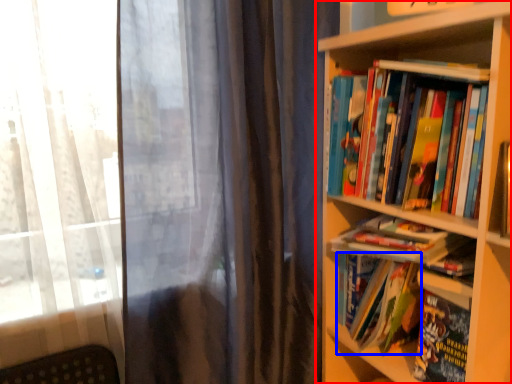
Question: Which of the following is the closest to the observer, bookcase (highlighted by a red box) or book (highlighted by a blue box)?

Choices:
 (A) bookcase
 (B) book

Answer: (A)